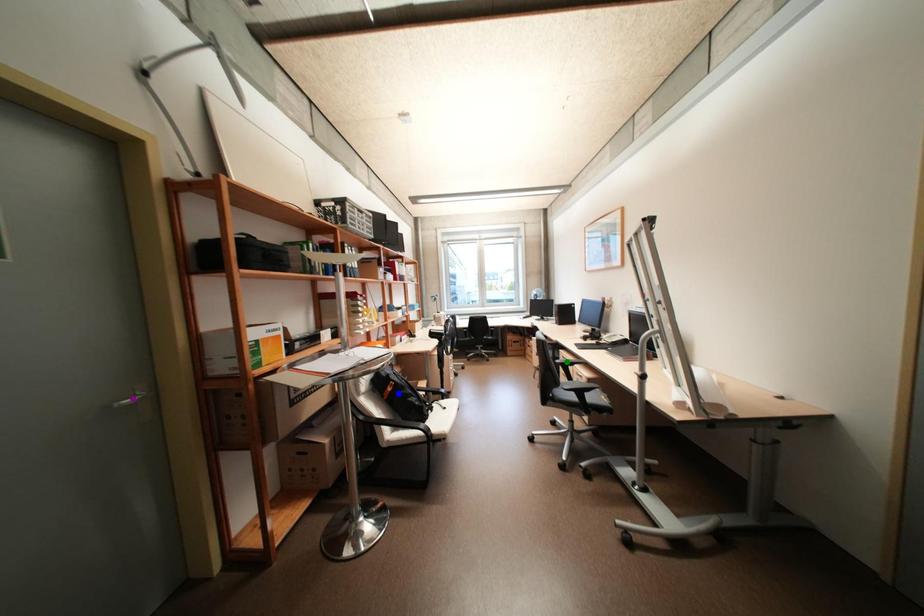
Looking at this image, order these from farthest to nearest:
- green point
- purple point
- blue point

green point
blue point
purple point